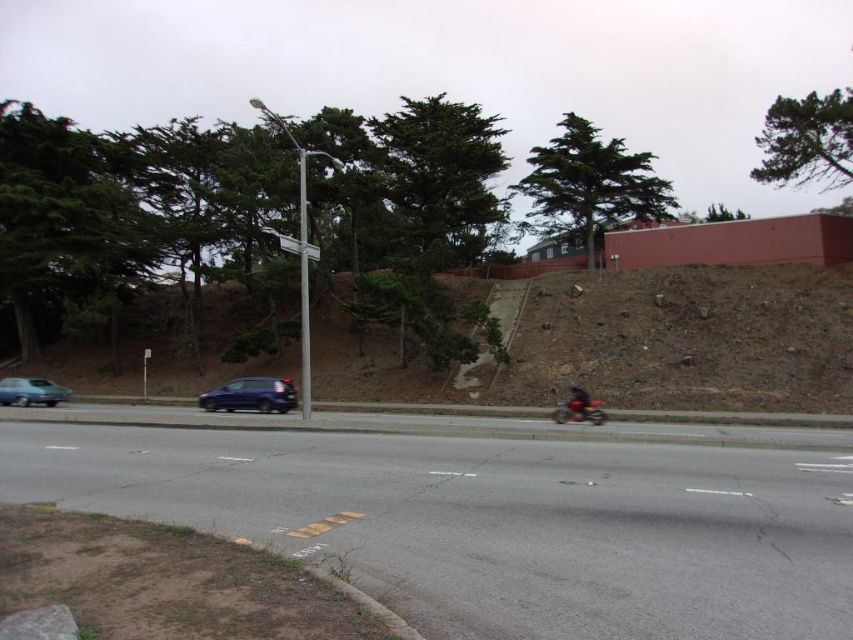
Consider the image. You are a delivery driver who needs to park your truck near the matte blue sedan at left without blocking the green leafy tree at upper center. Given that your truck is 20 feet long, is there enough space between them to park safely?

The distance between the green leafy tree at upper center and the matte blue sedan at left is 195.75 feet. Since your truck is only 20 feet long, there is ample space to park safely between them without blocking either object.

You are a pedestrian standing on the sidewalk near the streetlight. You notice two green leafy trees in the background. Which tree, the green leafy tree at upper center or the green leafy tree at upper right, is located to the left of the other?

The green leafy tree at upper center is positioned on the left side of the green leafy tree at upper right.